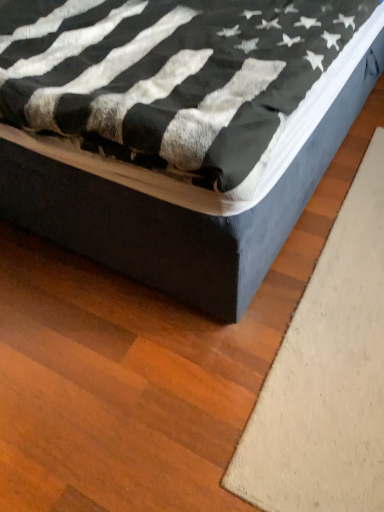
This screenshot has height=512, width=384. What do you see at coordinates (180, 130) in the screenshot? I see `velvet blue bed at center` at bounding box center [180, 130].

Find the location of a particular element. This screenshot has width=384, height=512. velvet blue bed at center is located at coordinates (180, 130).

In order to face velvet blue bed at center, should I rotate leftwards or rightwards?

A 0.185 degree turn to the left will do.

The image size is (384, 512). What are the coordinates of `velvet blue bed at center` in the screenshot? It's located at (180, 130).